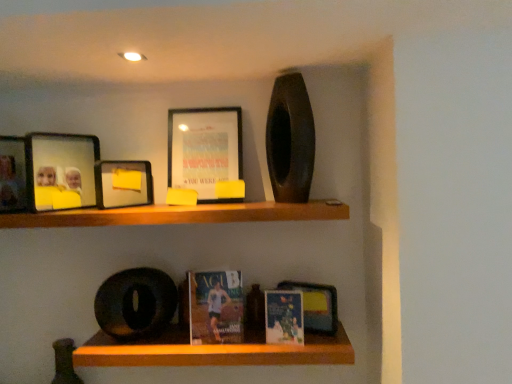
I want to click on vacant area that lies to the right of matte paper book at center, acting as the first paperback book starting from the right, so click(317, 341).